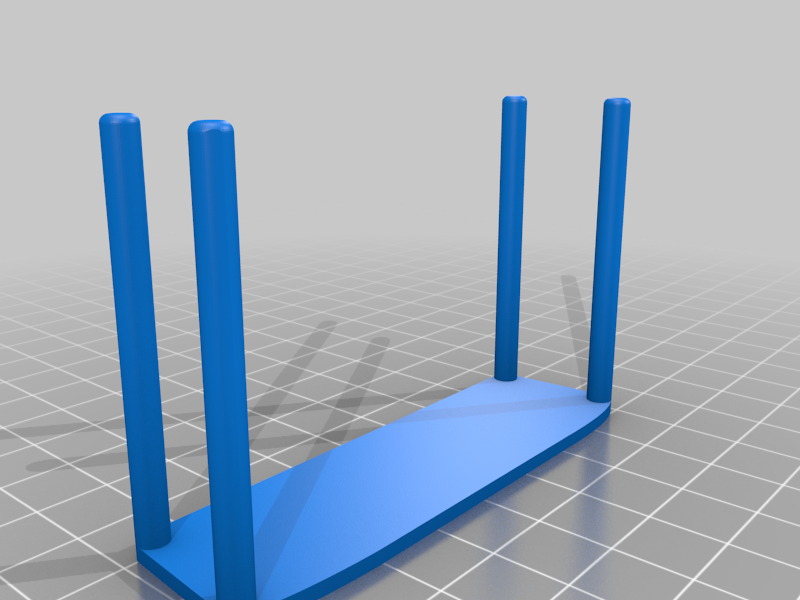
This screenshot has height=600, width=800. I want to click on bench, so click(498, 441).